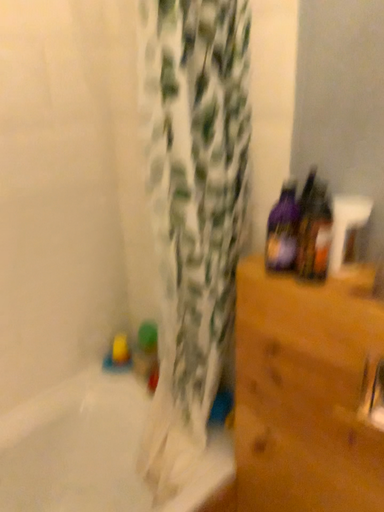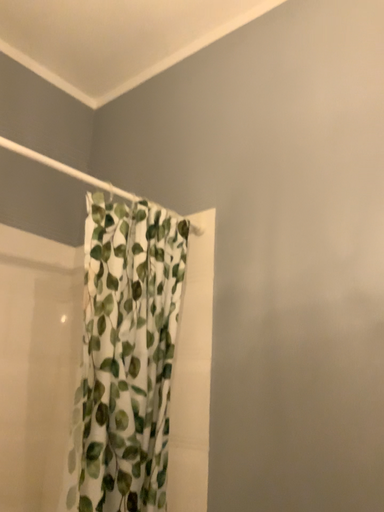
Question: How did the camera likely rotate when shooting the video?

Choices:
 (A) rotated downward
 (B) rotated upward

Answer: (B)